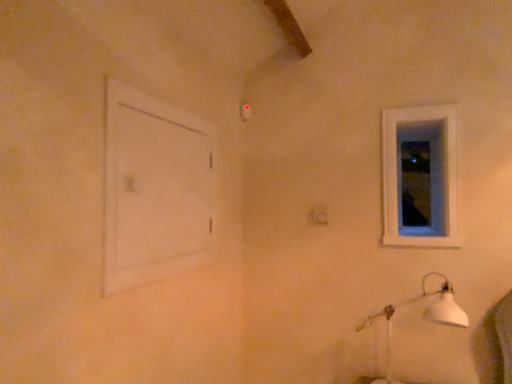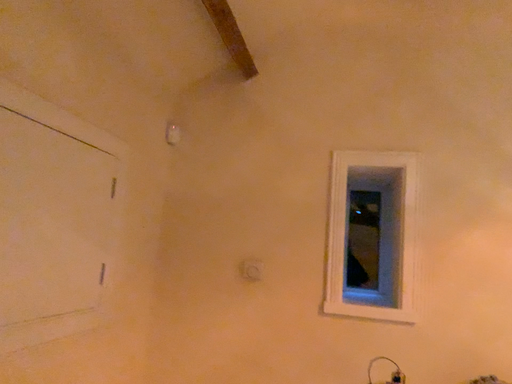
Question: How did the camera likely rotate when shooting the video?

Choices:
 (A) rotated right
 (B) rotated left

Answer: (A)